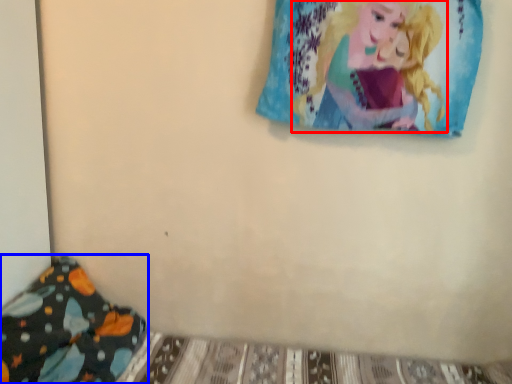
Question: Which object is closer to the camera taking this photo, person (highlighted by a red box) or pillow (highlighted by a blue box)?

Choices:
 (A) person
 (B) pillow

Answer: (B)